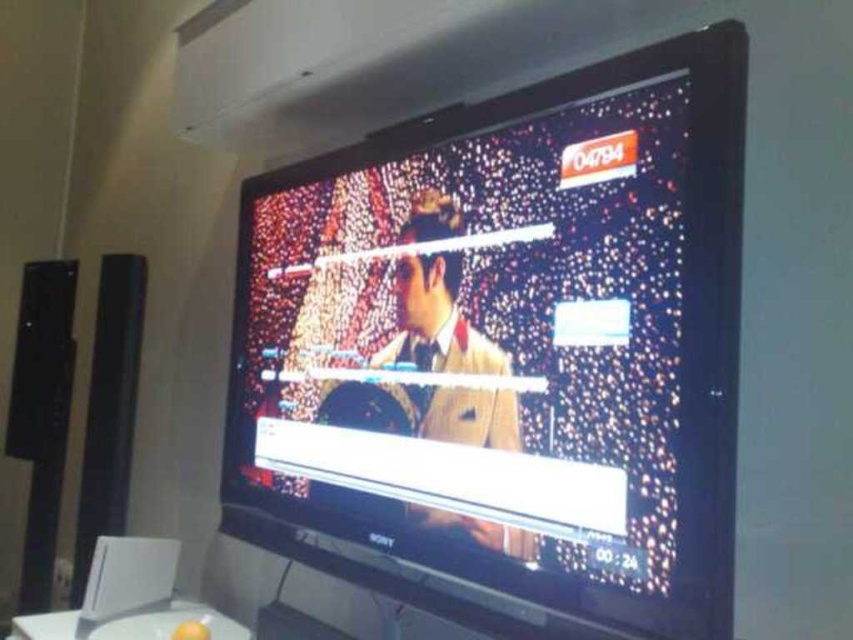
You are standing 1.5 meters away from the television screen. There is a point at coordinates point (532, 180) on the screen. Can you reach that point with your hand?

The distance of point (532, 180) from viewer is 1.13 meters, so you are standing 1.5 meters away from the television screen. Since the point is closer than your standing distance, you cannot reach it with your hand because the point is behind you.

You are setting up a home theater system and have a small shelf that can only hold items up to the size of the white glossy table at lower center. Can the black matte speaker at left fit on this shelf?

The black matte speaker at left is bigger than the white glossy table at lower center, so it cannot fit on the shelf designed for the table.